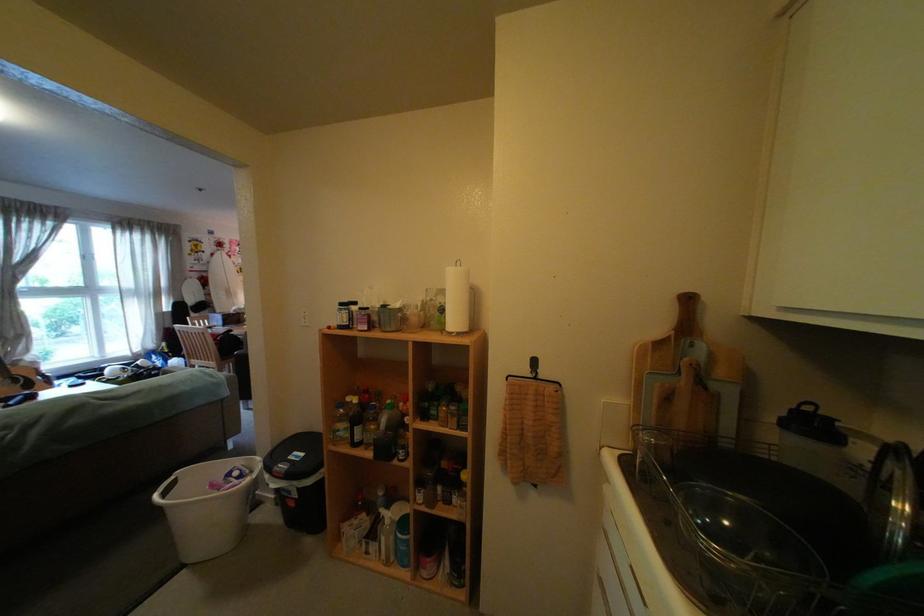
What do you see at coordinates (650, 452) in the screenshot?
I see `the glass jar handle` at bounding box center [650, 452].